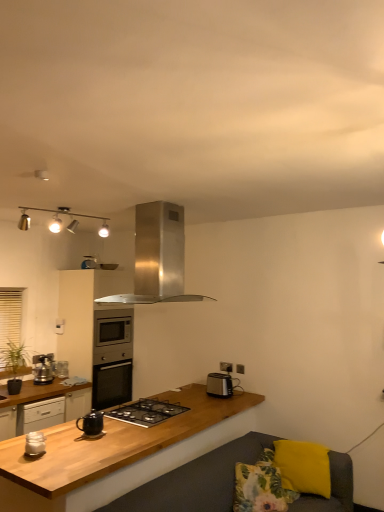
Question: Is floral fabric pillow at lower right, marked as the first pillow in a left-to-right arrangement, far from yellow fabric pillow at lower right, the first pillow positioned from the right?

Choices:
 (A) yes
 (B) no

Answer: (B)

Question: Is floral fabric pillow at lower right, marked as the first pillow in a left-to-right arrangement, in front of yellow fabric pillow at lower right, positioned as the 2th pillow in left-to-right order?

Choices:
 (A) no
 (B) yes

Answer: (B)

Question: Is floral fabric pillow at lower right, marked as the first pillow in a left-to-right arrangement, in contact with yellow fabric pillow at lower right, the first pillow positioned from the right?

Choices:
 (A) yes
 (B) no

Answer: (B)

Question: From the image's perspective, is floral fabric pillow at lower right, marked as the first pillow in a left-to-right arrangement, under yellow fabric pillow at lower right, the first pillow positioned from the right?

Choices:
 (A) no
 (B) yes

Answer: (B)

Question: Is floral fabric pillow at lower right, marked as the first pillow in a left-to-right arrangement, at the right side of yellow fabric pillow at lower right, positioned as the 2th pillow in left-to-right order?

Choices:
 (A) yes
 (B) no

Answer: (B)

Question: From the image's perspective, relative to white glossy jar at lower left, the second kitchen appliance from the top, is matte black kettle at center above or below?

Choices:
 (A) below
 (B) above

Answer: (A)

Question: Relative to white glossy jar at lower left, the second kitchen appliance positioned from the left, is matte black kettle at center in front or behind?

Choices:
 (A) behind
 (B) front

Answer: (A)

Question: In the image, is matte black kettle at center on the left side or the right side of white glossy jar at lower left, which is counted as the 4th kitchen appliance, starting from the back?

Choices:
 (A) left
 (B) right

Answer: (B)

Question: Considering the positions of matte black kettle at center and white glossy jar at lower left, arranged as the third kitchen appliance when viewed from the right, in the image, is matte black kettle at center wider or thinner than white glossy jar at lower left, arranged as the third kitchen appliance when viewed from the right,?

Choices:
 (A) wide
 (B) thin

Answer: (A)

Question: Is wooden at center to the left or to the right of stainless steel range hood at upper center, which ranks as the second kitchen appliance in right-to-left order, in the image?

Choices:
 (A) left
 (B) right

Answer: (A)

Question: Considering the positions of wooden at center and stainless steel range hood at upper center, the 2th kitchen appliance positioned from the front, in the image, is wooden at center wider or thinner than stainless steel range hood at upper center, the 2th kitchen appliance positioned from the front,?

Choices:
 (A) thin
 (B) wide

Answer: (B)

Question: From the image's perspective, is wooden at center above or below stainless steel range hood at upper center, which ranks as the 1th kitchen appliance in top-to-bottom order?

Choices:
 (A) above
 (B) below

Answer: (B)

Question: Choose the correct answer: Is wooden at center inside stainless steel range hood at upper center, placed as the 3th kitchen appliance when sorted from left to right, or outside it?

Choices:
 (A) outside
 (B) inside

Answer: (A)

Question: From their relative heights in the image, would you say black glass gas stove at center is taller or shorter than yellow fabric pillow at lower right, positioned as the 2th pillow in left-to-right order?

Choices:
 (A) short
 (B) tall

Answer: (A)

Question: Considering the relative positions of black glass gas stove at center and yellow fabric pillow at lower right, positioned as the 2th pillow in left-to-right order, in the image provided, is black glass gas stove at center to the left or to the right of yellow fabric pillow at lower right, positioned as the 2th pillow in left-to-right order,?

Choices:
 (A) right
 (B) left

Answer: (B)